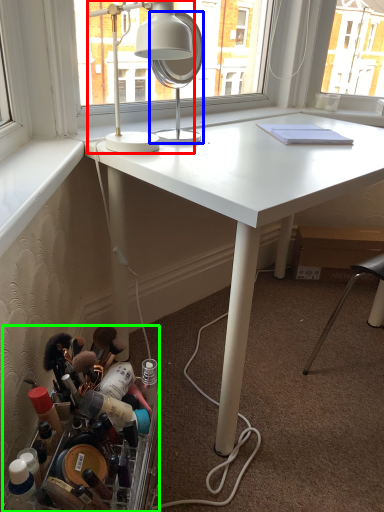
Question: Which object is the farthest from lamp (highlighted by a red box)? Choose among these: mirror (highlighted by a blue box) or toiletry (highlighted by a green box).

Choices:
 (A) mirror
 (B) toiletry

Answer: (B)